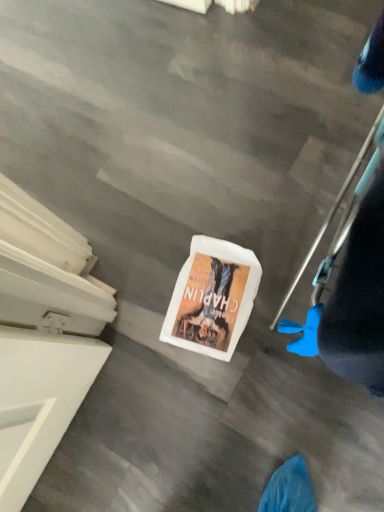
This screenshot has width=384, height=512. What do you see at coordinates (352, 289) in the screenshot? I see `blue rubber glove at lower right` at bounding box center [352, 289].

Image resolution: width=384 pixels, height=512 pixels. I want to click on blue rubber glove at lower right, so click(x=352, y=289).

Measure the distance between blue rubber glove at lower right and camera.

blue rubber glove at lower right and camera are 7.88 inches apart.

Image resolution: width=384 pixels, height=512 pixels. I want to click on white matte book at center, so click(x=212, y=298).

What do you see at coordinates (212, 298) in the screenshot? I see `white matte book at center` at bounding box center [212, 298].

Locate an element on the screen. blue rubber glove at lower right is located at coordinates (352, 289).

Considering the positions of objects blue rubber glove at lower right and white matte book at center in the image provided, who is more to the right, blue rubber glove at lower right or white matte book at center?

Positioned to the right is blue rubber glove at lower right.

Is the position of blue rubber glove at lower right less distant than that of white matte book at center?

That is True.

Between point (375, 81) and point (174, 342), which one is positioned in front?

The point (375, 81) is in front.

Consider the image. From the image's perspective, which one is positioned higher, blue rubber glove at lower right or white matte book at center?

blue rubber glove at lower right, from the image's perspective.

From a real-world perspective, is blue rubber glove at lower right on white matte book at center?

Yes.

Consider the image. Is blue rubber glove at lower right wider or thinner than white matte book at center?

Considering their sizes, blue rubber glove at lower right looks slimmer than white matte book at center.

Can you confirm if blue rubber glove at lower right is shorter than white matte book at center?

In fact, blue rubber glove at lower right may be taller than white matte book at center.

Considering the relative sizes of blue rubber glove at lower right and white matte book at center in the image provided, is blue rubber glove at lower right bigger than white matte book at center?

Indeed, blue rubber glove at lower right has a larger size compared to white matte book at center.

Which is correct: blue rubber glove at lower right is inside white matte book at center, or outside of it?

blue rubber glove at lower right is not enclosed by white matte book at center.

Are blue rubber glove at lower right and white matte book at center far apart?

No.

Could you tell me if blue rubber glove at lower right is facing white matte book at center?

No, blue rubber glove at lower right does not turn towards white matte book at center.

Locate an element on the screen. Image resolution: width=384 pixels, height=512 pixels. magazine on the left of blue rubber glove at lower right is located at coordinates (212, 298).

Considering the relative positions of white matte book at center and blue rubber glove at lower right in the image provided, is white matte book at center to the right of blue rubber glove at lower right from the viewer's perspective?

No.

Does white matte book at center come behind blue rubber glove at lower right?

Yes.

Is point (212, 322) closer to viewer compared to point (360, 267)?

No, it is not.

From the image's perspective, which is below, white matte book at center or blue rubber glove at lower right?

From the image's view, white matte book at center is below.

From a real-world perspective, who is located higher, white matte book at center or blue rubber glove at lower right?

In real-world perspective, blue rubber glove at lower right is above.

In terms of width, does white matte book at center look wider or thinner when compared to blue rubber glove at lower right?

In the image, white matte book at center appears to be wider than blue rubber glove at lower right.

Considering the relative sizes of white matte book at center and blue rubber glove at lower right in the image provided, is white matte book at center shorter than blue rubber glove at lower right?

Correct, white matte book at center is not as tall as blue rubber glove at lower right.

Considering the sizes of objects white matte book at center and blue rubber glove at lower right in the image provided, who is smaller, white matte book at center or blue rubber glove at lower right?

Smaller between the two is white matte book at center.

From the picture: Would you say white matte book at center contains blue rubber glove at lower right?

No, white matte book at center does not contain blue rubber glove at lower right.

Are white matte book at center and blue rubber glove at lower right beside each other?

No, white matte book at center is not in contact with blue rubber glove at lower right.

Is white matte book at center positioned with its back to blue rubber glove at lower right?

white matte book at center is not turned away from blue rubber glove at lower right.

At what (x,y) coordinates should I click in order to perform the action: click on person to the right of white matte book at center. Please return your answer as a coordinate pair (x, y). Looking at the image, I should click on (352, 289).

The width and height of the screenshot is (384, 512). What are the coordinates of `person that is above the white matte book at center (from the image's perspective)` in the screenshot? It's located at (352, 289).

Image resolution: width=384 pixels, height=512 pixels. I want to click on person that appears in front of the white matte book at center, so click(352, 289).